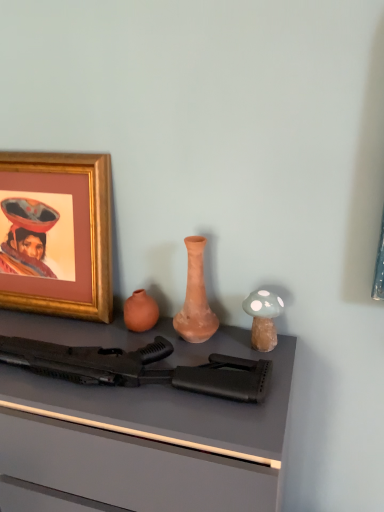
I want to click on free space to the right of matte clay vase at center, so click(238, 339).